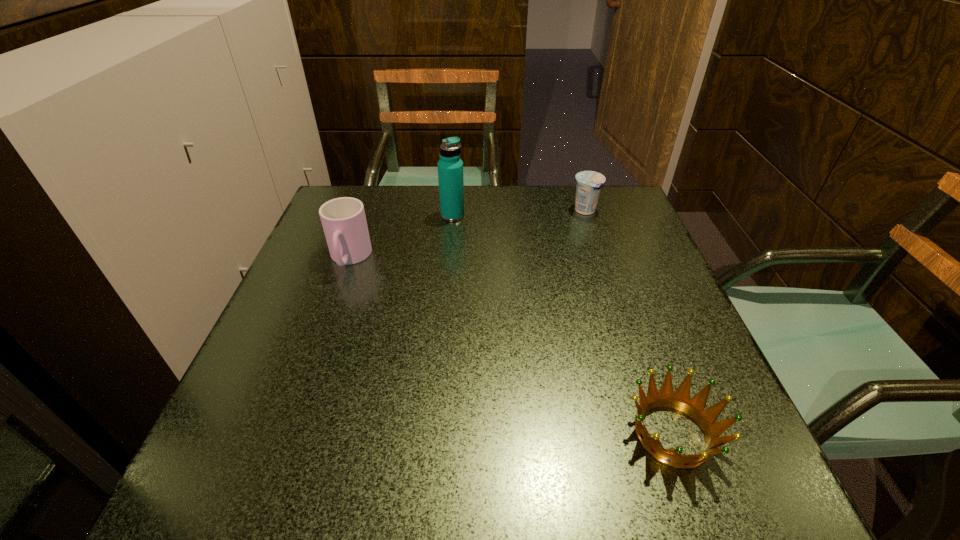
Locate an element on the screen. vacant area situated on the back of the nearest object is located at coordinates (624, 299).

Where is `water bottle present at the far edge`? The image size is (960, 540). water bottle present at the far edge is located at coordinates (450, 167).

Identify the location of yogurt located in the far edge section of the desktop. (589, 183).

Find the location of `object present at the near edge`. object present at the near edge is located at coordinates (680, 400).

The image size is (960, 540). Find the location of `object situated at the left edge`. object situated at the left edge is located at coordinates point(343,219).

Where is `yogurt that is positioned at the right edge`? The image size is (960, 540). yogurt that is positioned at the right edge is located at coordinates (589, 183).

Where is `crown at the right edge`? Image resolution: width=960 pixels, height=540 pixels. crown at the right edge is located at coordinates (680, 400).

Locate an element on the screen. object present at the far right corner is located at coordinates 589,183.

At what (x,y) coordinates should I click in order to perform the action: click on object positioned at the near right corner. Please return your answer as a coordinate pair (x, y). The width and height of the screenshot is (960, 540). Looking at the image, I should click on (680, 400).

At what (x,y) coordinates should I click in order to perform the action: click on blank space at the far edge of the desktop. Please return your answer as a coordinate pair (x, y). The height and width of the screenshot is (540, 960). Looking at the image, I should click on (396, 215).